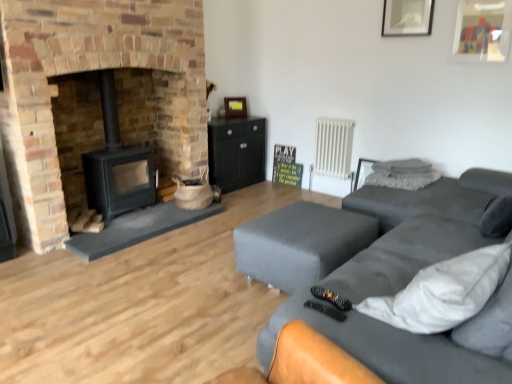
The height and width of the screenshot is (384, 512). Identify the location of free point above white textured pillow at upper right, which ranks as the second pillow in top-to-bottom order (from a real-world perspective). (401, 164).